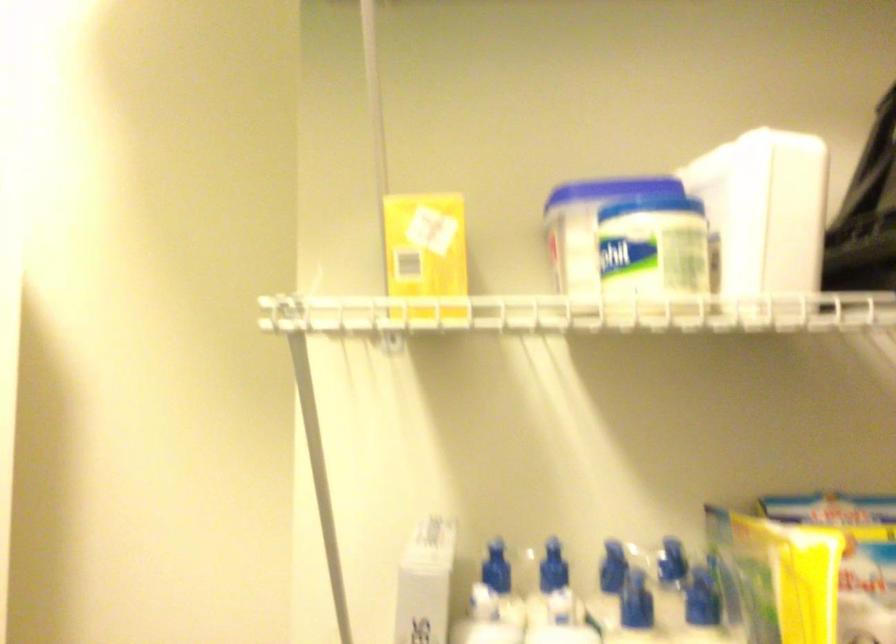
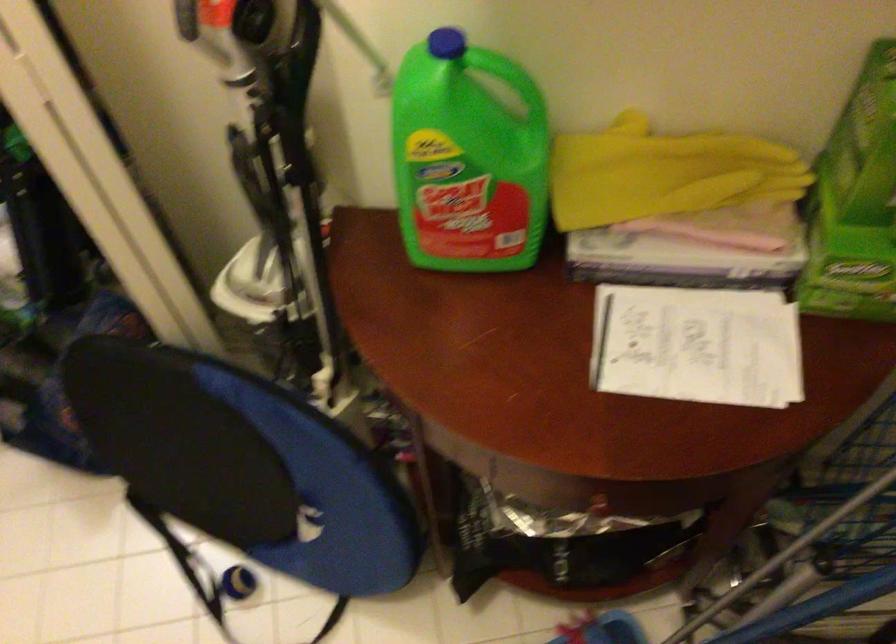
Question: The images are taken continuously from a first-person perspective. In which direction is your viewpoint rotating?

Choices:
 (A) Left
 (B) Right
 (C) Up
 (D) Down

Answer: (D)